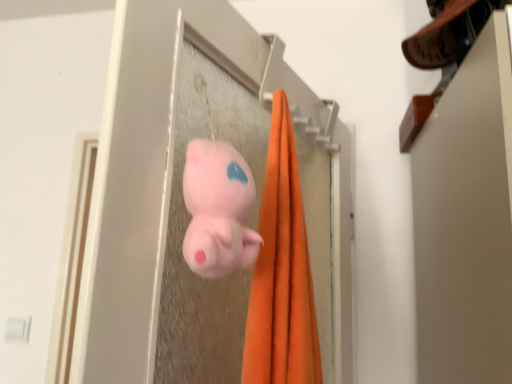
Question: From the image's perspective, is fluffy pink plush at center located above pink plush toy at center?

Choices:
 (A) yes
 (B) no

Answer: (B)

Question: Is fluffy pink plush at center behind pink plush toy at center?

Choices:
 (A) no
 (B) yes

Answer: (A)

Question: From a real-world perspective, is fluffy pink plush at center located higher than pink plush toy at center?

Choices:
 (A) yes
 (B) no

Answer: (B)

Question: Does fluffy pink plush at center have a larger size compared to pink plush toy at center?

Choices:
 (A) yes
 (B) no

Answer: (B)

Question: Is fluffy pink plush at center surrounding pink plush toy at center?

Choices:
 (A) no
 (B) yes

Answer: (A)

Question: Does fluffy pink plush at center have a greater width compared to pink plush toy at center?

Choices:
 (A) no
 (B) yes

Answer: (A)

Question: Is pink plush toy at center not inside fluffy pink plush at center?

Choices:
 (A) yes
 (B) no

Answer: (A)

Question: Considering the relative sizes of pink plush toy at center and fluffy pink plush at center in the image provided, is pink plush toy at center smaller than fluffy pink plush at center?

Choices:
 (A) no
 (B) yes

Answer: (A)

Question: Is fluffy pink plush at center inside pink plush toy at center?

Choices:
 (A) no
 (B) yes

Answer: (A)

Question: Does pink plush toy at center appear on the left side of fluffy pink plush at center?

Choices:
 (A) yes
 (B) no

Answer: (B)

Question: Is the depth of pink plush toy at center less than that of fluffy pink plush at center?

Choices:
 (A) yes
 (B) no

Answer: (B)

Question: Is pink plush toy at center not near fluffy pink plush at center?

Choices:
 (A) yes
 (B) no

Answer: (B)

Question: Based on their positions, is fluffy pink plush at center located to the left or right of pink plush toy at center?

Choices:
 (A) right
 (B) left

Answer: (B)